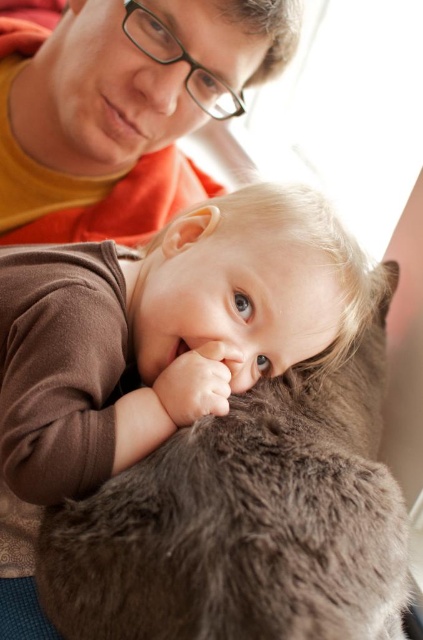
Which of these two, fuzzy brown cat at center or matte orange shirt at upper left, stands taller?

matte orange shirt at upper left

Is fuzzy brown cat at center further to camera compared to matte orange shirt at upper left?

That is False.

Locate an element on the screen. The width and height of the screenshot is (423, 640). fuzzy brown cat at center is located at coordinates (244, 520).